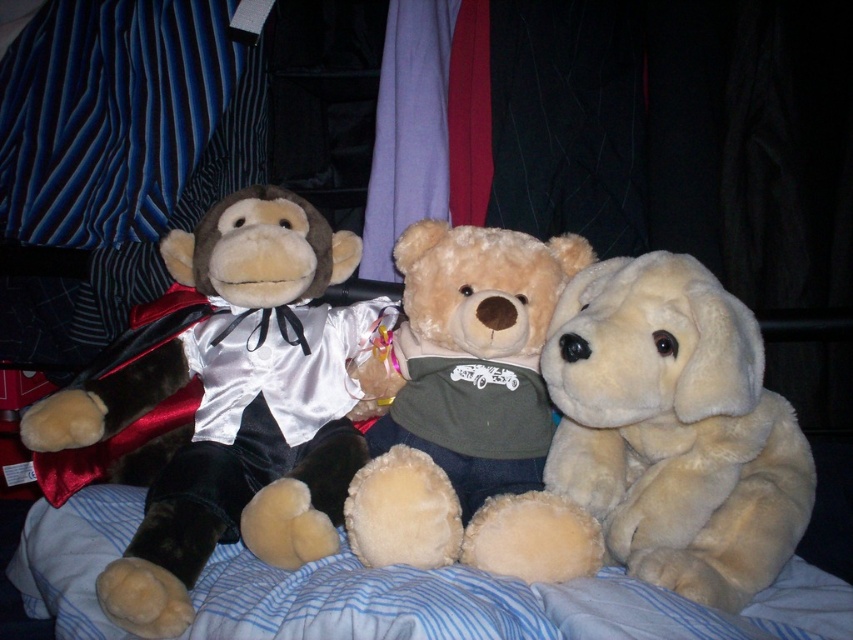
Question: Can you confirm if velvet monkey at left is positioned to the right of soft plush teddy bear at center?

Choices:
 (A) yes
 (B) no

Answer: (B)

Question: Which point is closer to the camera taking this photo?

Choices:
 (A) (183, 499)
 (B) (657, 579)
 (C) (448, 516)

Answer: (B)

Question: Which object is the closest to the soft plush teddy bear at center?

Choices:
 (A) fluffy cream teddy bear at right
 (B) velvet monkey at left

Answer: (A)

Question: Can you confirm if velvet monkey at left is positioned to the left of soft plush teddy bear at center?

Choices:
 (A) yes
 (B) no

Answer: (A)

Question: Does velvet monkey at left have a smaller size compared to fluffy cream teddy bear at right?

Choices:
 (A) yes
 (B) no

Answer: (B)

Question: Which object is closer to the camera taking this photo?

Choices:
 (A) fluffy cream teddy bear at right
 (B) velvet monkey at left

Answer: (A)